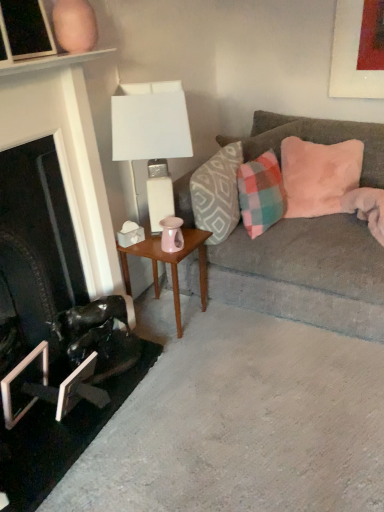
I want to click on free point to the right of metallic silver picture frame at lower left, which appears as the first picture frame when ordered from the bottom, so click(112, 399).